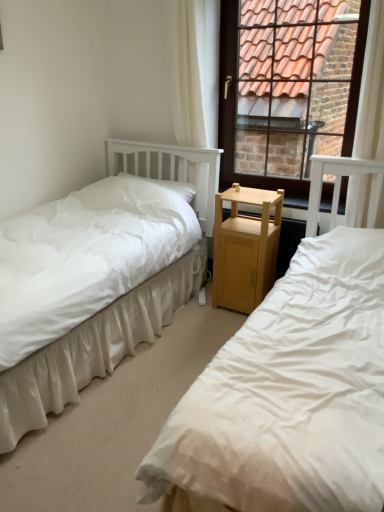
Question: From a real-world perspective, is white sheer curtain at upper right, which is the first curtain from right to left, under light brown wood nightstand at center?

Choices:
 (A) no
 (B) yes

Answer: (A)

Question: Is white sheer curtain at upper right, positioned as the second curtain in left-to-right order, closer to the viewer compared to light brown wood nightstand at center?

Choices:
 (A) no
 (B) yes

Answer: (B)

Question: Is white sheer curtain at upper right, positioned as the second curtain in left-to-right order, thinner than light brown wood nightstand at center?

Choices:
 (A) yes
 (B) no

Answer: (A)

Question: Is light brown wood nightstand at center located within white sheer curtain at upper right, positioned as the second curtain in left-to-right order?

Choices:
 (A) yes
 (B) no

Answer: (B)

Question: Does white sheer curtain at upper right, which is the first curtain from right to left, have a larger size compared to light brown wood nightstand at center?

Choices:
 (A) no
 (B) yes

Answer: (A)

Question: From a real-world perspective, is white soft pillow at center physically located above or below white fabric bed at left, which is the 2th bed in left-to-right order?

Choices:
 (A) above
 (B) below

Answer: (A)

Question: Visually, is white soft pillow at center positioned to the left or to the right of white fabric bed at left, which is counted as the first bed, starting from the right?

Choices:
 (A) right
 (B) left

Answer: (B)

Question: In terms of width, does white soft pillow at center look wider or thinner when compared to white fabric bed at left, which is counted as the first bed, starting from the right?

Choices:
 (A) wide
 (B) thin

Answer: (B)

Question: Choose the correct answer: Is white soft pillow at center inside white fabric bed at left, which is the 2th bed in left-to-right order, or outside it?

Choices:
 (A) outside
 (B) inside

Answer: (A)

Question: From the image's perspective, is light brown wood nightstand at center above or below white cotton bed at left, which is counted as the 2th bed, starting from the right?

Choices:
 (A) above
 (B) below

Answer: (A)

Question: Is light brown wood nightstand at center spatially inside white cotton bed at left, arranged as the 1th bed when viewed from the left, or outside of it?

Choices:
 (A) outside
 (B) inside

Answer: (A)

Question: From a real-world perspective, is light brown wood nightstand at center positioned above or below white cotton bed at left, which is counted as the 2th bed, starting from the right?

Choices:
 (A) below
 (B) above

Answer: (A)

Question: Does point (243, 258) appear closer or farther from the camera than point (185, 265)?

Choices:
 (A) closer
 (B) farther

Answer: (A)

Question: In the image, is white sheer curtain at upper right, positioned as the second curtain in left-to-right order, on the left side or the right side of white fabric curtain at upper center, which is the first curtain from left to right?

Choices:
 (A) left
 (B) right

Answer: (B)

Question: In the image, is white sheer curtain at upper right, positioned as the second curtain in left-to-right order, positioned in front of or behind white fabric curtain at upper center, placed as the second curtain when sorted from right to left?

Choices:
 (A) behind
 (B) front

Answer: (B)